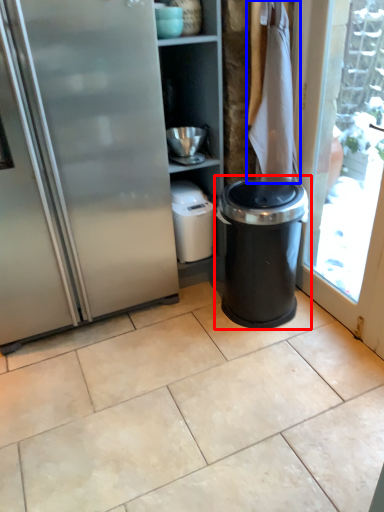
Question: Which of the following is the farthest to the observer, waste container (highlighted by a red box) or laundry (highlighted by a blue box)?

Choices:
 (A) waste container
 (B) laundry

Answer: (B)